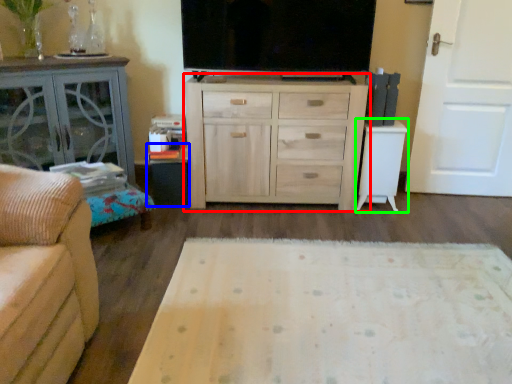
Question: Based on their relative distances, which object is nearer to chest of drawers (highlighted by a red box)? Choose from table (highlighted by a blue box) and table (highlighted by a green box).

Choices:
 (A) table
 (B) table

Answer: (B)